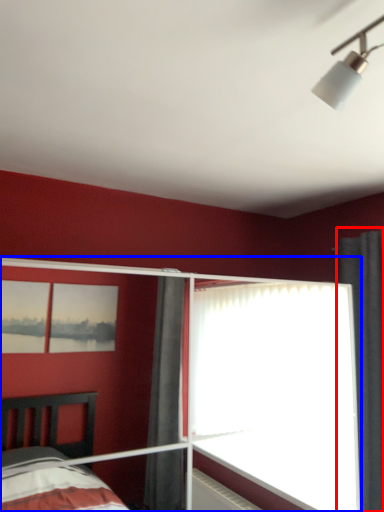
Question: Among these objects, which one is nearest to the camera, curtain (highlighted by a red box) or glass door (highlighted by a blue box)?

Choices:
 (A) curtain
 (B) glass door

Answer: (B)